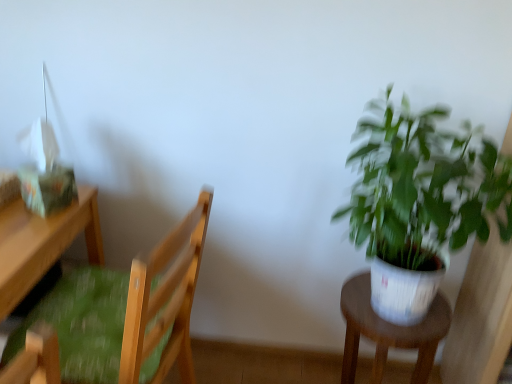
Question: Looking at their shapes, would you say white plastic stool at right is wider or thinner than wooden chair with green cushion at left?

Choices:
 (A) thin
 (B) wide

Answer: (A)

Question: Is white plastic stool at right in front of or behind wooden chair with green cushion at left in the image?

Choices:
 (A) behind
 (B) front

Answer: (A)

Question: Which object is the closest to the white plastic stool at right?

Choices:
 (A) wooden desk at left
 (B) green leafy plant at right
 (C) wooden chair with green cushion at left

Answer: (B)

Question: Estimate the real-world distances between objects in this image. Which object is closer to the wooden chair with green cushion at left?

Choices:
 (A) white plastic stool at right
 (B) wooden desk at left
 (C) green leafy plant at right

Answer: (B)